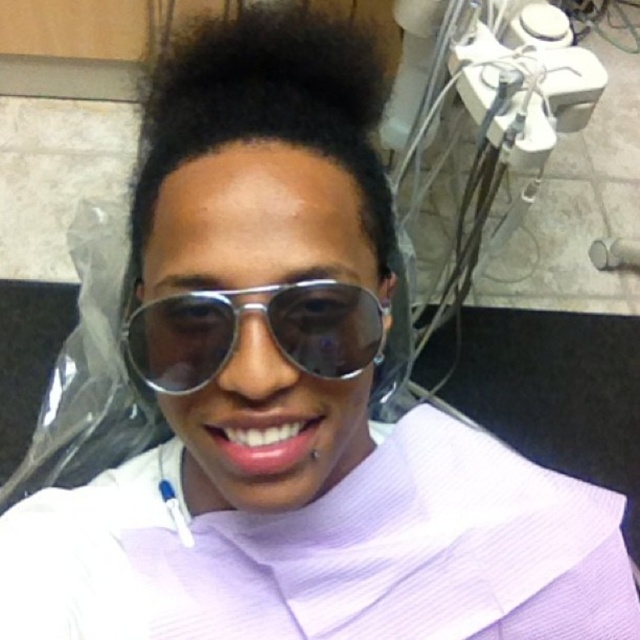
Question: Which object is farther from the camera taking this photo?

Choices:
 (A) metallic reflective goggles at center
 (B) dark matte hair at upper center

Answer: (B)

Question: Can you confirm if dark matte hair at upper center is smaller than metallic reflective goggles at center?

Choices:
 (A) yes
 (B) no

Answer: (B)

Question: Is dark matte hair at upper center below metallic reflective goggles at center?

Choices:
 (A) no
 (B) yes

Answer: (A)

Question: Which of the following is the closest to the observer?

Choices:
 (A) dark matte hair at upper center
 (B) metallic reflective goggles at center

Answer: (B)

Question: Which point is closer to the camera?

Choices:
 (A) dark matte hair at upper center
 (B) metallic reflective goggles at center

Answer: (B)

Question: Can you confirm if dark matte hair at upper center is thinner than metallic reflective goggles at center?

Choices:
 (A) yes
 (B) no

Answer: (B)